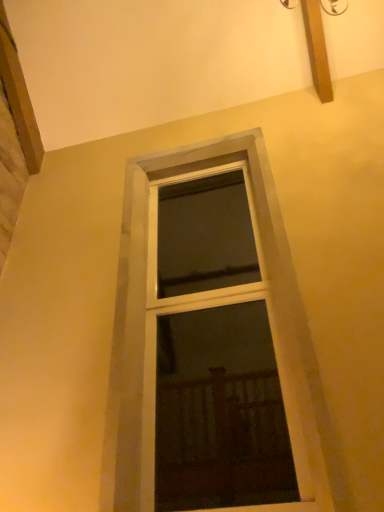
Where is `white wood window at center`? white wood window at center is located at coordinates (153, 339).

What do you see at coordinates (153, 339) in the screenshot?
I see `white wood window at center` at bounding box center [153, 339].

The image size is (384, 512). In order to click on white wood window at center in this screenshot , I will do `click(153, 339)`.